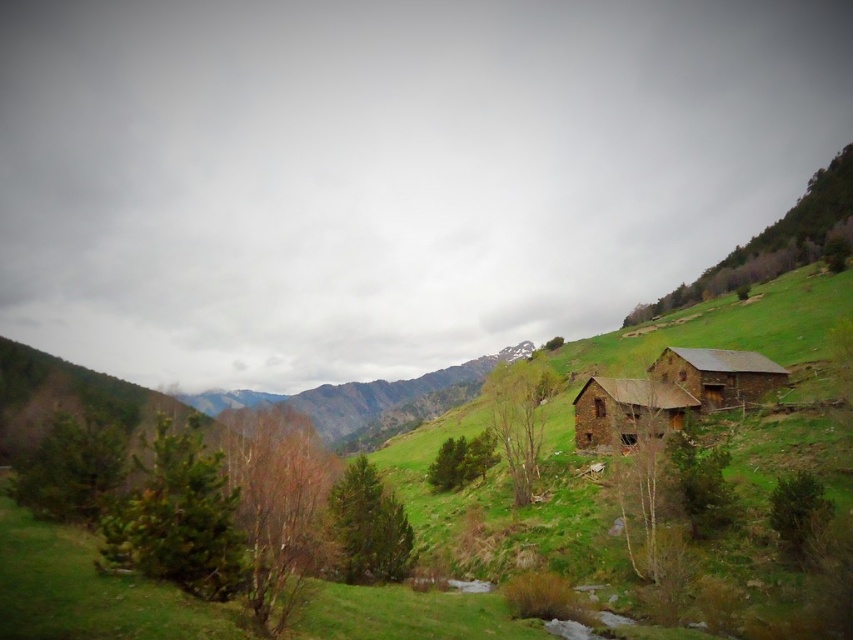
Does point (589, 388) come behind point (753, 381)?

Yes.

Looking at this image, between rustic stone hut at center and brown wooden hut at right, which one appears on the right side from the viewer's perspective?

brown wooden hut at right

In order to click on rustic stone hut at center in this screenshot , I will do `click(625, 412)`.

Locate an element on the screen. Image resolution: width=853 pixels, height=640 pixels. rustic stone hut at center is located at coordinates (625, 412).